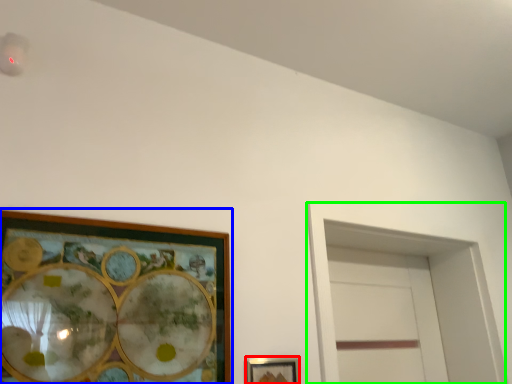
Question: Considering the real-world distances, which object is farthest from picture frame (highlighted by a red box)? picture frame (highlighted by a blue box) or glass door (highlighted by a green box)?

Choices:
 (A) picture frame
 (B) glass door

Answer: (B)